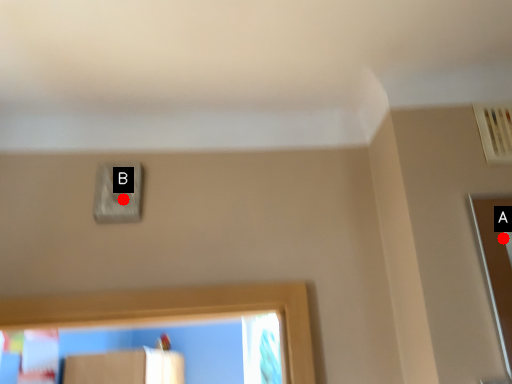
Question: Two points are circled on the image, labeled by A and B beside each circle. Which point is closer to the camera?

Choices:
 (A) A is closer
 (B) B is closer

Answer: (A)